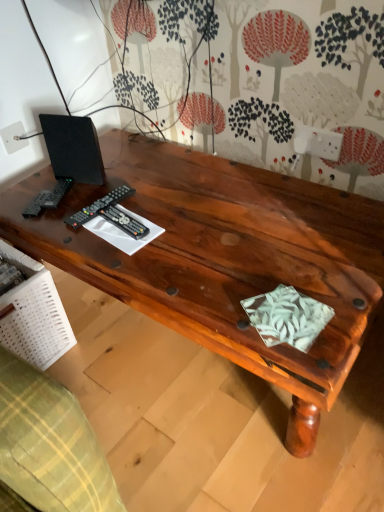
Question: Should I look upward or downward to see black plastic remote at center, acting as the first control starting from the right?

Choices:
 (A) up
 (B) down

Answer: (A)

Question: From the image's perspective, is black matte speaker at upper left beneath white plastic electric outlet at upper left?

Choices:
 (A) no
 (B) yes

Answer: (B)

Question: Is white plastic electric outlet at upper left inside black matte speaker at upper left?

Choices:
 (A) yes
 (B) no

Answer: (B)

Question: Is black matte speaker at upper left wider than white plastic electric outlet at upper left?

Choices:
 (A) yes
 (B) no

Answer: (A)

Question: Is black matte speaker at upper left in front of white plastic electric outlet at upper left?

Choices:
 (A) yes
 (B) no

Answer: (A)

Question: Is black matte speaker at upper left to the right of white plastic electric outlet at upper left from the viewer's perspective?

Choices:
 (A) no
 (B) yes

Answer: (B)

Question: From a real-world perspective, is black matte speaker at upper left beneath white plastic electric outlet at upper left?

Choices:
 (A) yes
 (B) no

Answer: (B)

Question: Is black matte speaker at upper left positioned with its back to black plastic remote at left, the second control viewed from the right?

Choices:
 (A) yes
 (B) no

Answer: (B)

Question: Is black matte speaker at upper left to the left of black plastic remote at left, the second control viewed from the right, from the viewer's perspective?

Choices:
 (A) no
 (B) yes

Answer: (B)

Question: Is black matte speaker at upper left closer to the viewer compared to black plastic remote at left, the second control viewed from the right?

Choices:
 (A) yes
 (B) no

Answer: (B)

Question: From the image's perspective, does black matte speaker at upper left appear higher than black plastic remote at left, the second control viewed from the right?

Choices:
 (A) no
 (B) yes

Answer: (B)

Question: Can you confirm if black matte speaker at upper left is taller than black plastic remote at left, which appears as the 1th control when viewed from the left?

Choices:
 (A) yes
 (B) no

Answer: (A)

Question: Would you say black plastic remote at left, the second control viewed from the right, is part of black matte speaker at upper left's contents?

Choices:
 (A) yes
 (B) no

Answer: (B)

Question: Is black plastic remote at left, which appears as the 1th control when viewed from the left, bigger than black matte speaker at upper left?

Choices:
 (A) no
 (B) yes

Answer: (A)